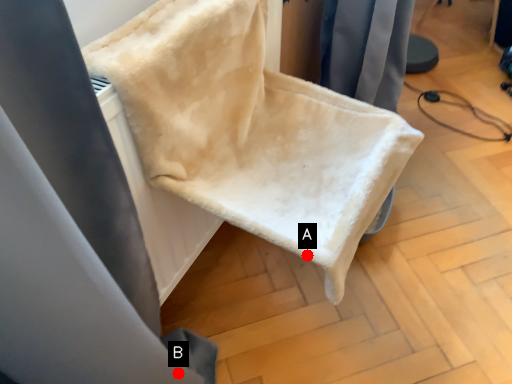
Question: Two points are circled on the image, labeled by A and B beside each circle. Which point is closer to the camera?

Choices:
 (A) A is closer
 (B) B is closer

Answer: (A)